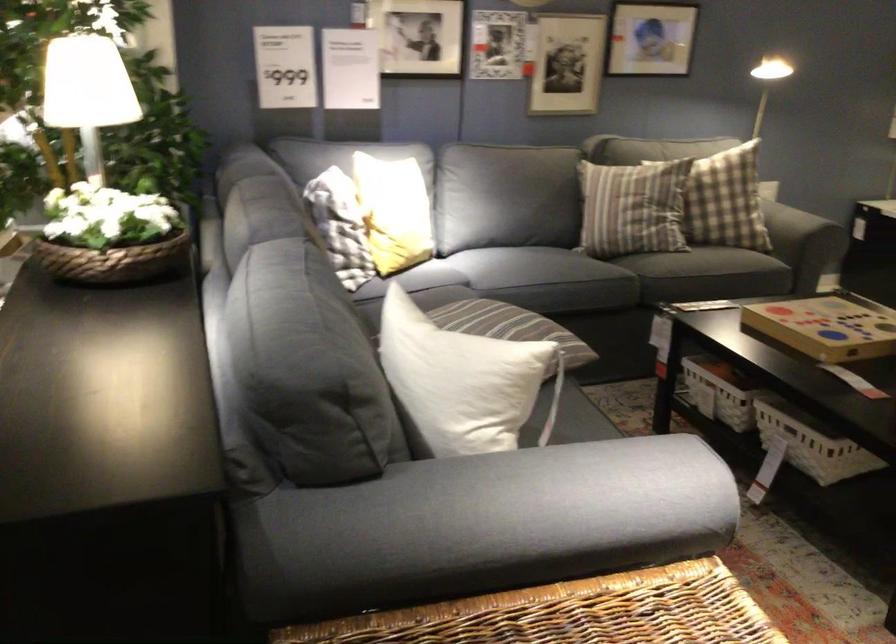
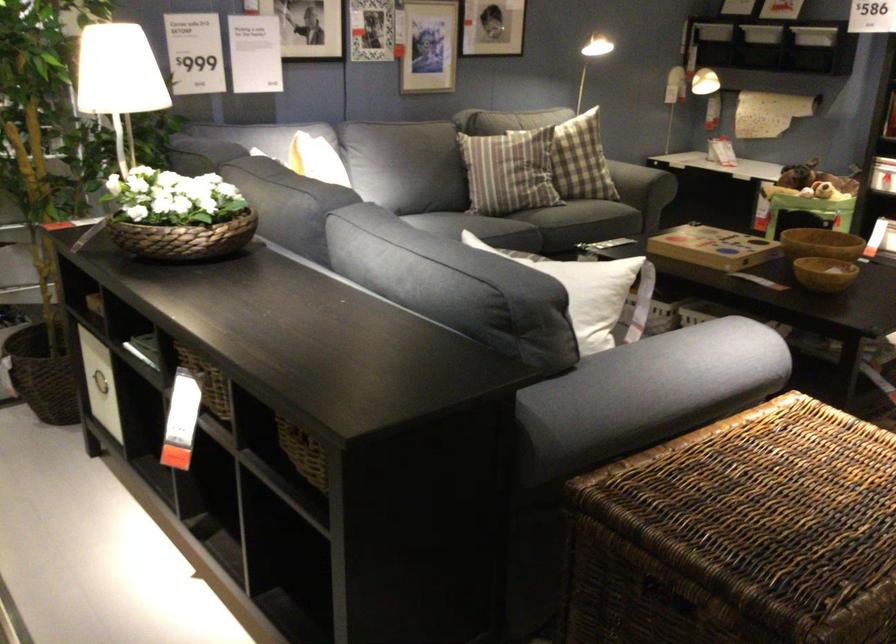
Question: I am providing you with two images of the same scene from different viewpoints. After the viewpoint changes to image2, which objects are now occluded?

Choices:
 (A) white storage bin
 (B) red and grey cap
 (C) woven flower basket
 (D) sofa sitting surface

Answer: (D)